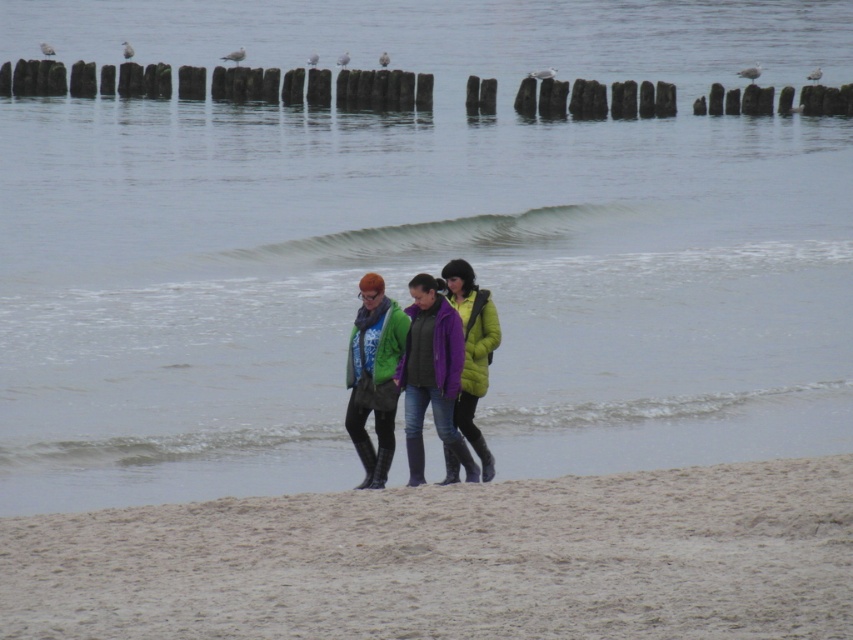
You are standing at the shoreline on the beach and see two points marked on the sand. The first point is at coordinate point (404, 244) and the second point is at coordinate point (405, 340). Which point is closer to you?

Point (404, 244) is further to the viewer than point (405, 340), so the second point is closer to you.